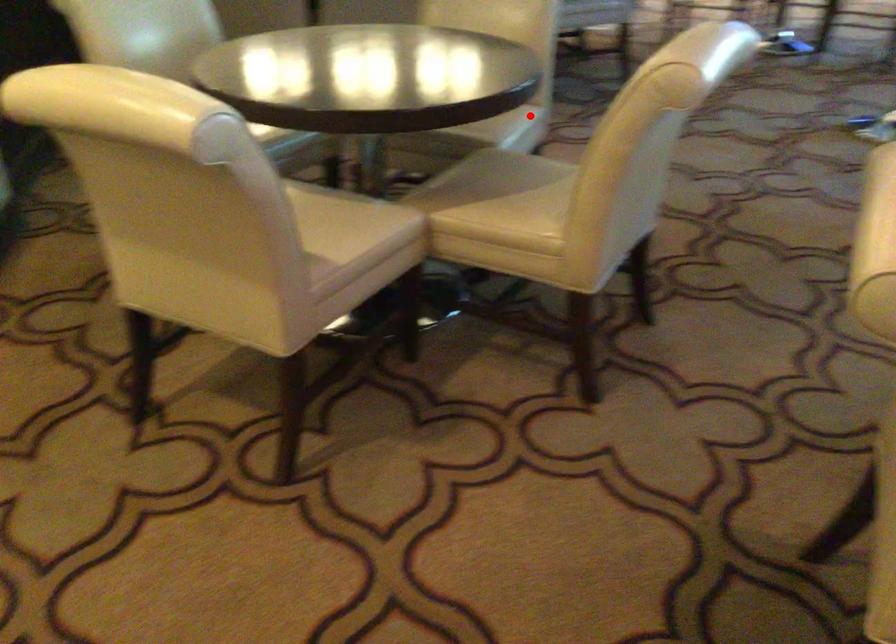
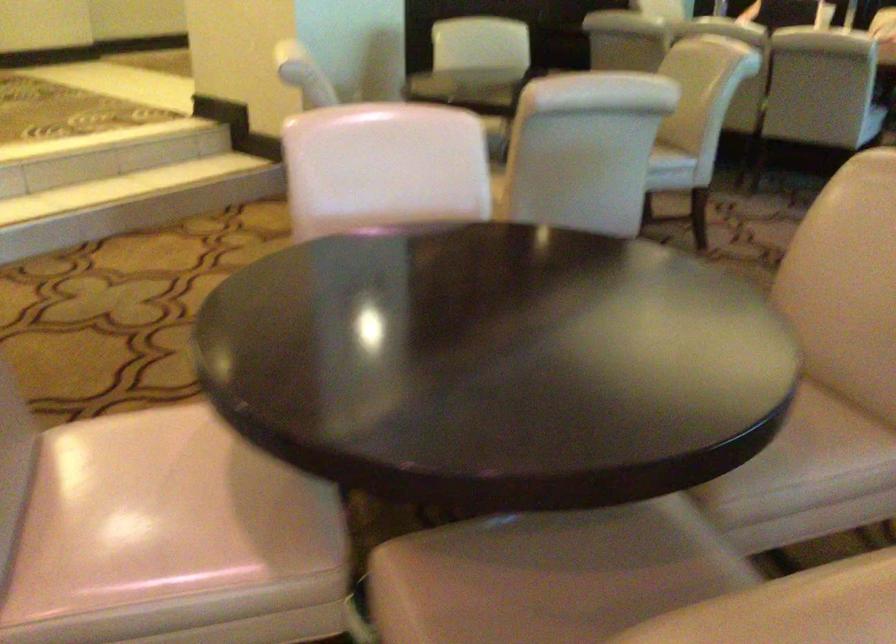
Question: I am providing you with two images of the same scene from different viewpoints. In image1, a red point is highlighted. Considering the same 3D point in image2, which of the following is correct?

Choices:
 (A) It is closer
 (B) It is farther

Answer: (B)